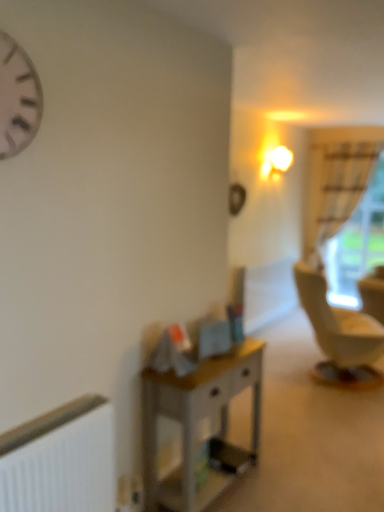
Question: Can you confirm if white matte radiator at lower left is positioned to the left of white matte clock at upper left?

Choices:
 (A) yes
 (B) no

Answer: (B)

Question: Is white matte radiator at lower left at the right side of white matte clock at upper left?

Choices:
 (A) no
 (B) yes

Answer: (B)

Question: From the image's perspective, does white matte radiator at lower left appear lower than white matte clock at upper left?

Choices:
 (A) yes
 (B) no

Answer: (A)

Question: From a real-world perspective, is white matte radiator at lower left located higher than white matte clock at upper left?

Choices:
 (A) no
 (B) yes

Answer: (A)

Question: Is white matte radiator at lower left in contact with white matte clock at upper left?

Choices:
 (A) yes
 (B) no

Answer: (B)

Question: Considering the relative sizes of white matte radiator at lower left and white matte clock at upper left in the image provided, is white matte radiator at lower left thinner than white matte clock at upper left?

Choices:
 (A) yes
 (B) no

Answer: (B)

Question: Is wooden desk at center positioned beyond the bounds of white sheer curtain at right?

Choices:
 (A) no
 (B) yes

Answer: (B)

Question: Could you tell me if wooden desk at center is facing white sheer curtain at right?

Choices:
 (A) yes
 (B) no

Answer: (B)

Question: Is white sheer curtain at right surrounded by wooden desk at center?

Choices:
 (A) yes
 (B) no

Answer: (B)

Question: Is wooden desk at center in front of white sheer curtain at right?

Choices:
 (A) no
 (B) yes

Answer: (B)

Question: Considering the relative sizes of wooden desk at center and white sheer curtain at right in the image provided, is wooden desk at center smaller than white sheer curtain at right?

Choices:
 (A) yes
 (B) no

Answer: (A)

Question: Is wooden desk at center further to camera compared to white sheer curtain at right?

Choices:
 (A) yes
 (B) no

Answer: (B)

Question: Is white sheer curtain at right not near white matte clock at upper left?

Choices:
 (A) no
 (B) yes

Answer: (B)